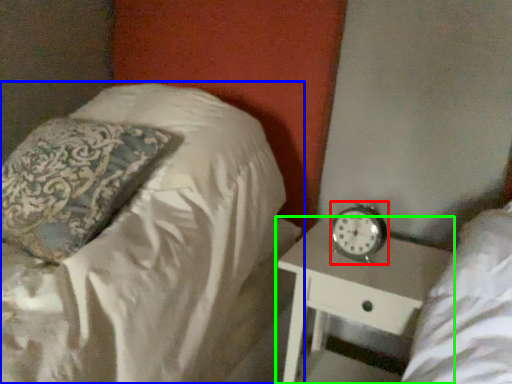
Question: Which object is the farthest from clock (highlighted by a red box)? Choose among these: bed (highlighted by a blue box) or nightstand (highlighted by a green box).

Choices:
 (A) bed
 (B) nightstand

Answer: (A)